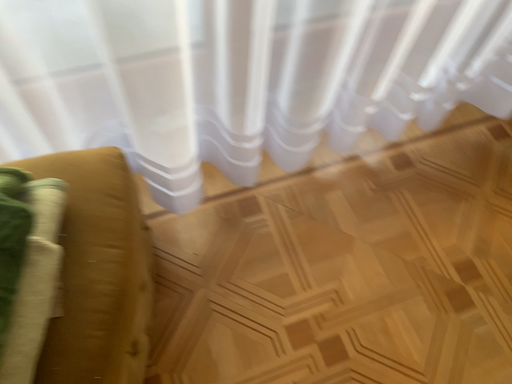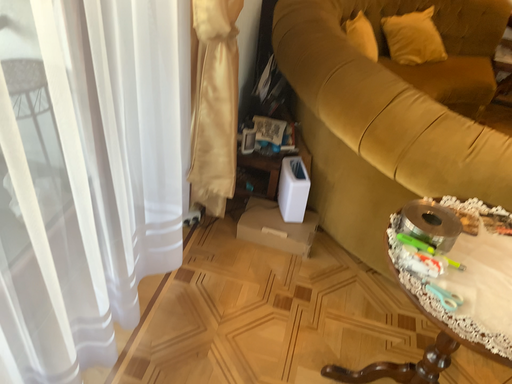
Question: Which way did the camera rotate in the video?

Choices:
 (A) rotated upward
 (B) rotated downward

Answer: (A)